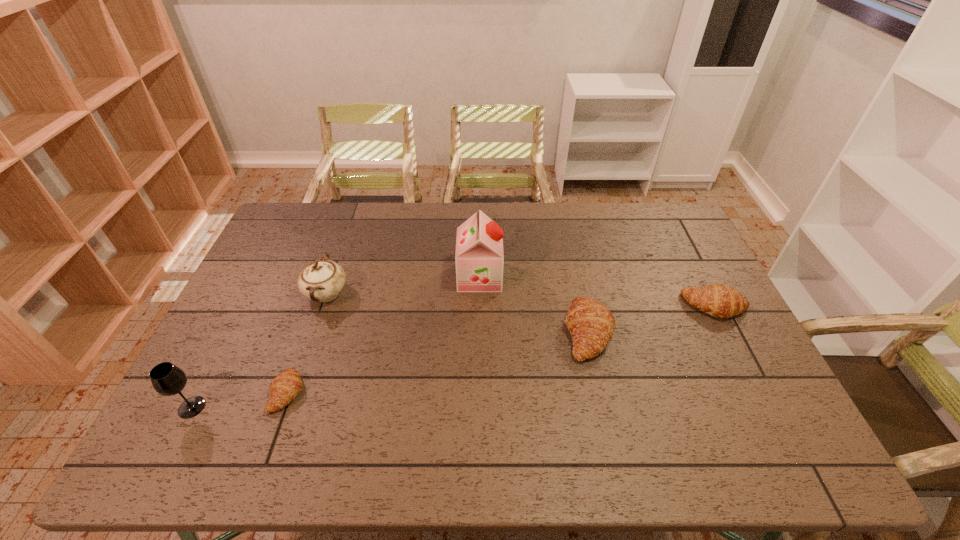
In order to click on free spot between the soya milk and the second shortest crescent roll in this screenshot , I will do `click(597, 292)`.

At what (x,y) coordinates should I click in order to perform the action: click on unoccupied area between the leftmost object and the chinaware. Please return your answer as a coordinate pair (x, y). The image size is (960, 540). Looking at the image, I should click on (259, 350).

At what (x,y) coordinates should I click in order to perform the action: click on vacant area that lies between the chinaware and the soya milk. Please return your answer as a coordinate pair (x, y). This screenshot has width=960, height=540. Looking at the image, I should click on (403, 285).

Identify the location of vacant space that is in between the third object from right to left and the fifth object from left to right. (534, 304).

You are a GUI agent. You are given a task and a screenshot of the screen. Output one action in this format:
    pyautogui.click(x=<x>, y=<y>)
    Task: Click on the vacant area that lies between the second crescent roll from left to right and the wineglass
    The width and height of the screenshot is (960, 540).
    Given the screenshot: What is the action you would take?
    pyautogui.click(x=390, y=369)

Identify the location of object that can be found as the second closest to the chinaware. This screenshot has width=960, height=540. (167, 379).

Locate an element on the screen. Image resolution: width=960 pixels, height=540 pixels. object that stands as the third closest to the fifth object from left to right is located at coordinates (322, 280).

Locate which crescent roll ranks second in proximity to the nearest crescent roll. Please provide its 2D coordinates. Your answer should be formatted as a tuple, i.e. [(x, y)], where the tuple contains the x and y coordinates of a point satisfying the conditions above.

[(720, 301)]

Locate an element on the screen. crescent roll that is the nearest to the second shortest object is located at coordinates (591, 325).

Locate an element on the screen. The image size is (960, 540). vacant area in the image that satisfies the following two spatial constraints: 1. on the back side of the fifth object from left to right; 2. with the cap open on the tallest object is located at coordinates (576, 276).